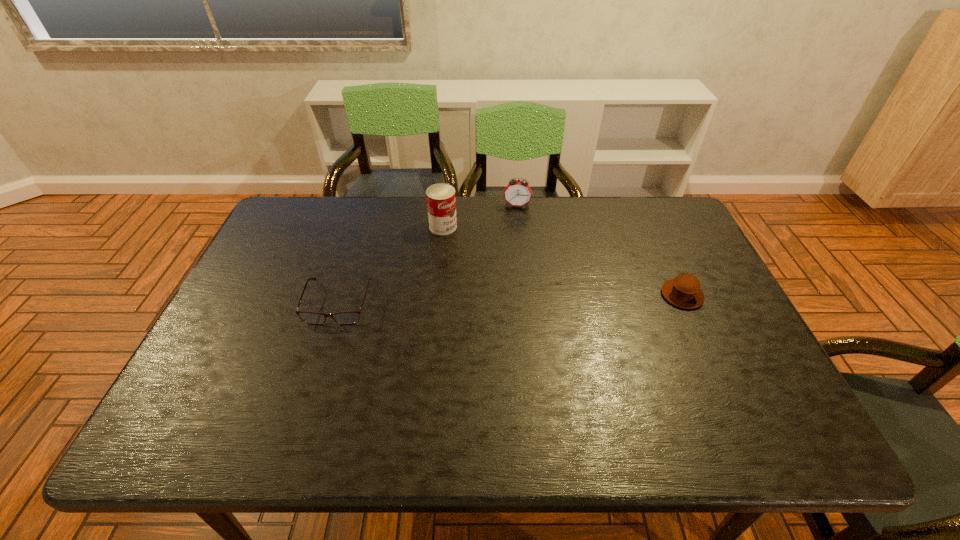
Where is `empty space that is in between the shortest object and the second object from right to left`? The image size is (960, 540). empty space that is in between the shortest object and the second object from right to left is located at coordinates (427, 254).

This screenshot has height=540, width=960. Find the location of `vacant area that lies between the farthest object and the second shortest object`. vacant area that lies between the farthest object and the second shortest object is located at coordinates click(x=599, y=251).

Find the location of `vacant space that is in between the leftmost object and the third shortest object`. vacant space that is in between the leftmost object and the third shortest object is located at coordinates (427, 254).

Locate an element on the screen. This screenshot has height=540, width=960. free space between the farthest object and the can is located at coordinates (480, 216).

This screenshot has height=540, width=960. Find the location of `empty space that is in between the farthest object and the leftmost object`. empty space that is in between the farthest object and the leftmost object is located at coordinates (427, 254).

Locate which object ranks third in proximity to the rightmost object. Please provide its 2D coordinates. Your answer should be formatted as a tuple, i.e. [(x, y)], where the tuple contains the x and y coordinates of a point satisfying the conditions above.

[(350, 317)]

Identify the location of object that ranks as the closest to the rightmost object. coord(518,193).

In order to click on free spot that satisfies the following two spatial constraints: 1. on the front side of the muffin; 2. on the left side of the farthest object in this screenshot , I will do `click(526, 295)`.

Locate an element on the screen. The height and width of the screenshot is (540, 960). vacant space that satisfies the following two spatial constraints: 1. on the back side of the third nearest object; 2. on the right side of the third object from left to right is located at coordinates (445, 206).

Locate an element on the screen. The image size is (960, 540). free location that satisfies the following two spatial constraints: 1. on the front side of the rightmost object; 2. on the right side of the alarm clock is located at coordinates (526, 295).